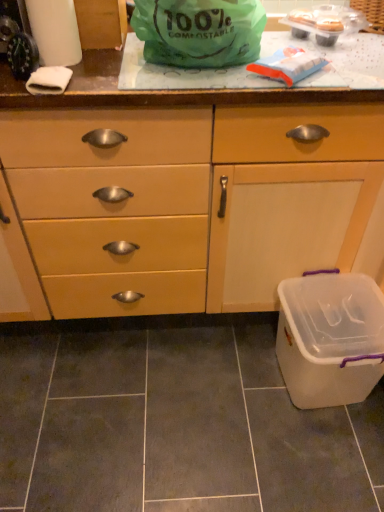
I want to click on free space in front of white plastic container at lower right, so click(319, 460).